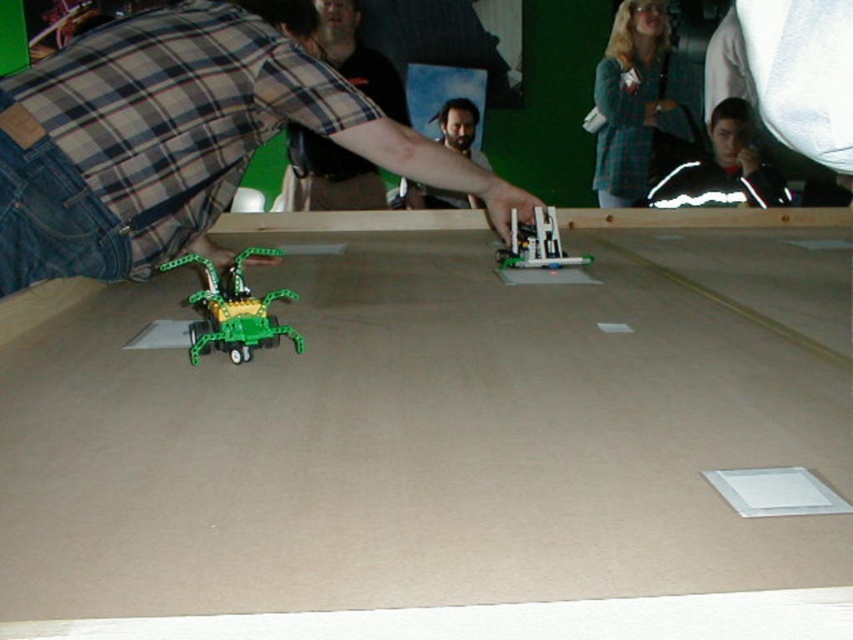
Does green plastic toy at lower left come in front of translucent plastic robot at center?

Yes, it is in front of translucent plastic robot at center.

Where is `green plastic toy at lower left`? Image resolution: width=853 pixels, height=640 pixels. green plastic toy at lower left is located at coordinates (233, 308).

Where is `green plastic toy at lower left`? This screenshot has height=640, width=853. green plastic toy at lower left is located at coordinates (233, 308).

Does plaid fabric shirt at center have a smaller size compared to translucent plastic robot at center?

No, plaid fabric shirt at center is not smaller than translucent plastic robot at center.

Does plaid fabric shirt at center appear on the left side of translucent plastic robot at center?

Correct, you'll find plaid fabric shirt at center to the left of translucent plastic robot at center.

Image resolution: width=853 pixels, height=640 pixels. Identify the location of plaid fabric shirt at center. (328, 176).

Between brown cardboard table at center and plaid fabric shirt at center, which one has less height?

Standing shorter between the two is plaid fabric shirt at center.

Does brown cardboard table at center have a lesser width compared to plaid fabric shirt at center?

In fact, brown cardboard table at center might be wider than plaid fabric shirt at center.

Find the location of a particular element. This screenshot has height=640, width=853. brown cardboard table at center is located at coordinates (444, 442).